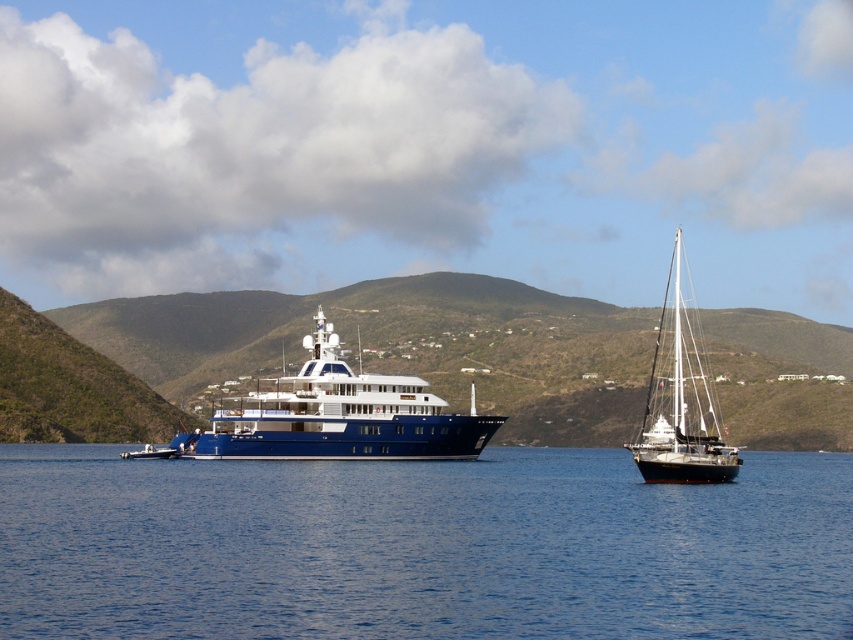
Is point (602, 456) farther from viewer compared to point (392, 426)?

Yes, point (602, 456) is farther from viewer.

Is blue water at center shorter than shiny blue yacht at center?

Incorrect, blue water at center's height does not fall short of shiny blue yacht at center's.

This screenshot has height=640, width=853. What are the coordinates of `blue water at center` in the screenshot? It's located at (421, 547).

Is shiny blue yacht at center thinner than black matte sailboat at right?

Yes.

How much distance is there between shiny blue yacht at center and black matte sailboat at right?

The distance of shiny blue yacht at center from black matte sailboat at right is 402.60 feet.

What do you see at coordinates (338, 416) in the screenshot? The height and width of the screenshot is (640, 853). I see `shiny blue yacht at center` at bounding box center [338, 416].

Identify the location of shiny blue yacht at center. (338, 416).

Who is taller, blue water at center or black matte sailboat at right?

With more height is black matte sailboat at right.

Between blue water at center and black matte sailboat at right, which one is positioned higher?

black matte sailboat at right is above.

The width and height of the screenshot is (853, 640). What are the coordinates of `blue water at center` in the screenshot? It's located at (421, 547).

Identify the location of blue water at center. (421, 547).